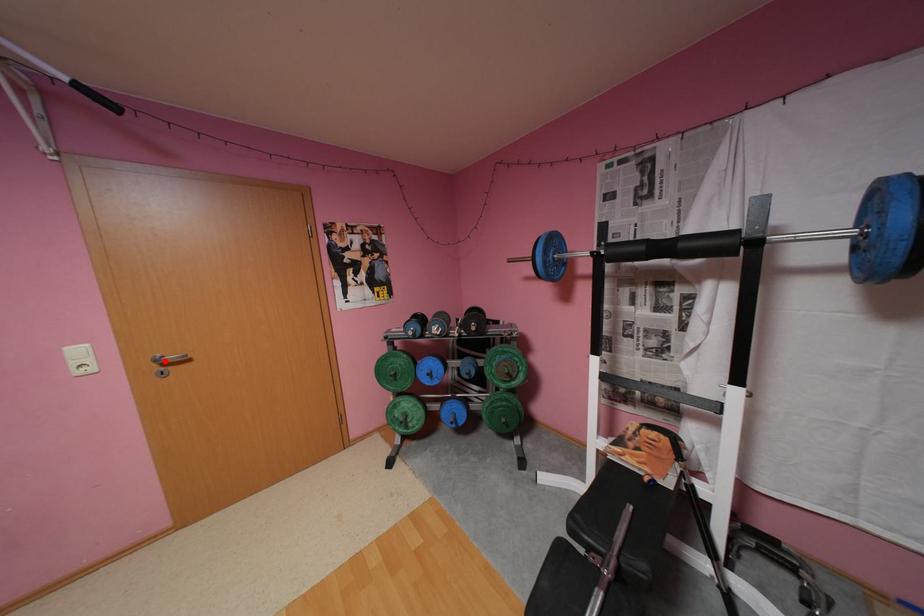
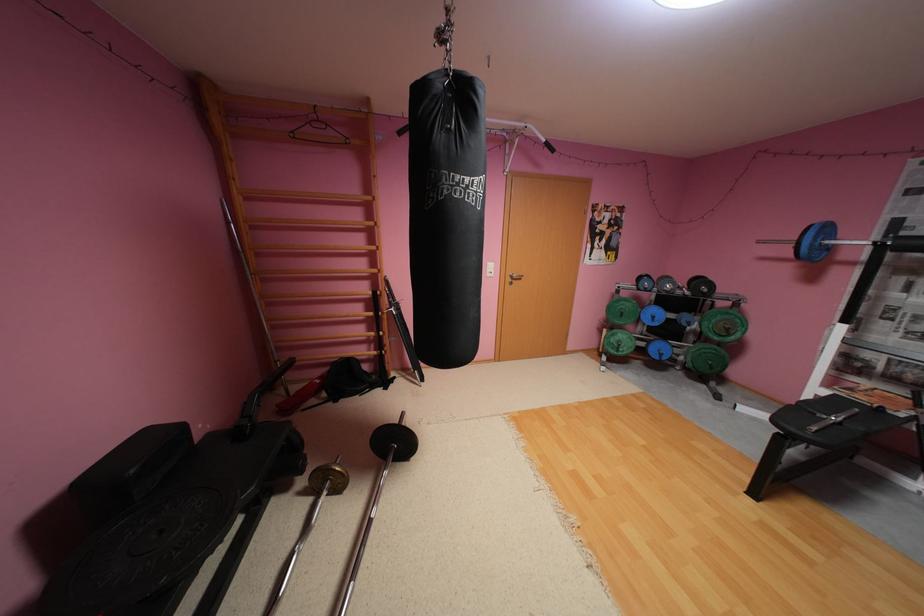
Where in the second image is the point corresponding to the highlighted location from the first image?

(520, 276)